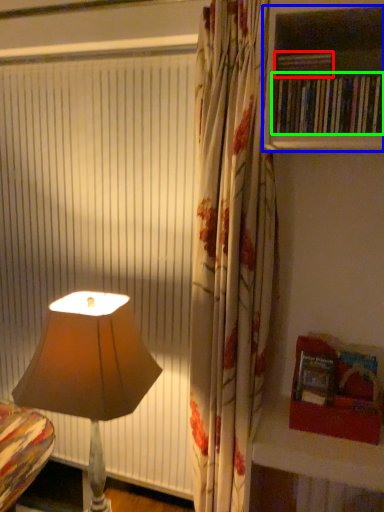
Question: Considering the real-world distances, which object is farthest from book (highlighted by a red box)? shelf (highlighted by a blue box) or book (highlighted by a green box)?

Choices:
 (A) shelf
 (B) book

Answer: (A)